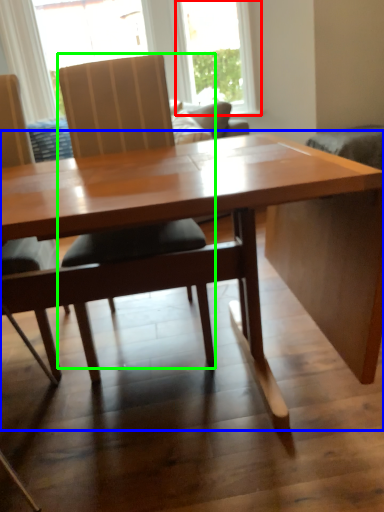
Question: Which object is the closest to the window (highlighted by a red box)? Choose among these: table (highlighted by a blue box) or chair (highlighted by a green box).

Choices:
 (A) table
 (B) chair

Answer: (B)